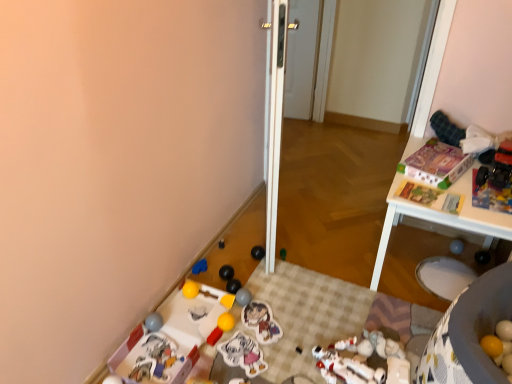
The image size is (512, 384). Identify the location of free space between plastic toy car at lower left, positioned as the 18th toy in right-to-left order, and yellow matte toy at lower center, acting as the 12th toy starting from the right. (196, 324).